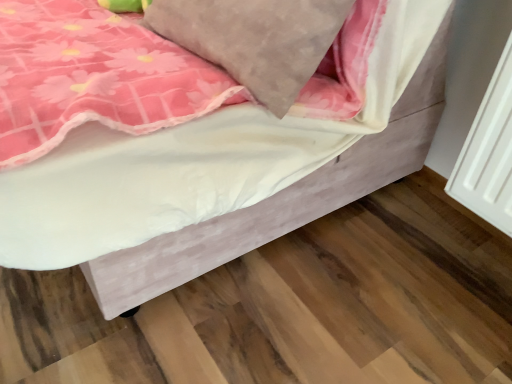
Question: From the image's perspective, is velvet pink bed at lower right on suede-like gray pillow at upper center?

Choices:
 (A) yes
 (B) no

Answer: (A)

Question: From a real-world perspective, is velvet pink bed at lower right physically above suede-like gray pillow at upper center?

Choices:
 (A) yes
 (B) no

Answer: (B)

Question: Does velvet pink bed at lower right have a lesser height compared to suede-like gray pillow at upper center?

Choices:
 (A) yes
 (B) no

Answer: (B)

Question: Is velvet pink bed at lower right outside of suede-like gray pillow at upper center?

Choices:
 (A) yes
 (B) no

Answer: (A)

Question: Is suede-like gray pillow at upper center at the back of velvet pink bed at lower right?

Choices:
 (A) no
 (B) yes

Answer: (B)

Question: Could you tell me if velvet pink bed at lower right is turned towards suede-like gray pillow at upper center?

Choices:
 (A) no
 (B) yes

Answer: (A)

Question: Can you confirm if suede-like gray pillow at upper center is taller than velvet pink bed at lower right?

Choices:
 (A) no
 (B) yes

Answer: (A)

Question: Is suede-like gray pillow at upper center at the left side of velvet pink bed at lower right?

Choices:
 (A) no
 (B) yes

Answer: (A)

Question: Is suede-like gray pillow at upper center at the right side of velvet pink bed at lower right?

Choices:
 (A) no
 (B) yes

Answer: (B)

Question: Is velvet pink bed at lower right completely or partially inside suede-like gray pillow at upper center?

Choices:
 (A) no
 (B) yes

Answer: (A)

Question: Considering the relative sizes of suede-like gray pillow at upper center and velvet pink bed at lower right in the image provided, is suede-like gray pillow at upper center shorter than velvet pink bed at lower right?

Choices:
 (A) no
 (B) yes

Answer: (B)

Question: Is suede-like gray pillow at upper center next to velvet pink bed at lower right and touching it?

Choices:
 (A) yes
 (B) no

Answer: (B)

Question: Based on their positions, is velvet pink bed at lower right located to the left or right of suede-like gray pillow at upper center?

Choices:
 (A) left
 (B) right

Answer: (A)